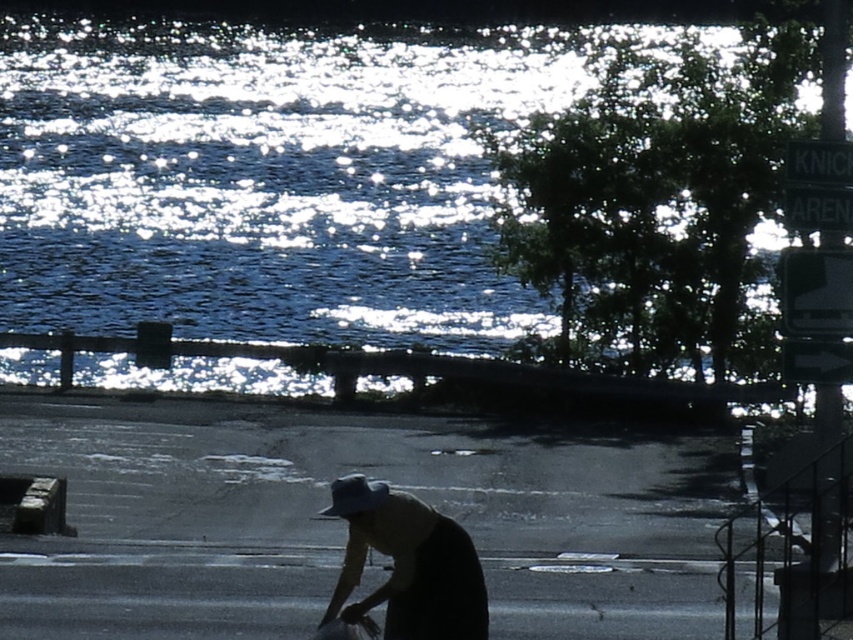
In the scene shown: Is sparkling blue water at upper center above black plastic sign at upper right?

Indeed, sparkling blue water at upper center is positioned over black plastic sign at upper right.

You are a GUI agent. You are given a task and a screenshot of the screen. Output one action in this format:
    pyautogui.click(x=<x>, y=<y>)
    Task: Click on the sparkling blue water at upper center
    The width and height of the screenshot is (853, 640).
    Given the screenshot: What is the action you would take?
    pyautogui.click(x=271, y=168)

Does point (57, 323) lie in front of point (840, 177)?

No, (57, 323) is further to viewer.

Where is `sparkling blue water at upper center`? This screenshot has width=853, height=640. sparkling blue water at upper center is located at coordinates (271, 168).

Is sparkling blue water at upper center thinner than metallic reflective sign at upper right?

No.

Who is more forward, (155, 67) or (804, 282)?

Point (804, 282)

Describe the element at coordinates (271, 168) in the screenshot. The width and height of the screenshot is (853, 640). I see `sparkling blue water at upper center` at that location.

Image resolution: width=853 pixels, height=640 pixels. I want to click on sparkling blue water at upper center, so click(271, 168).

Based on the photo, does silhouette fabric hat at lower center have a larger size compared to metallic reflective sign at upper right?

Yes.

How far apart are silhouette fabric hat at lower center and metallic reflective sign at upper right?

They are 3.23 meters apart.

At what (x,y) coordinates should I click in order to perform the action: click on silhouette fabric hat at lower center. Please return your answer as a coordinate pair (x, y). Image resolution: width=853 pixels, height=640 pixels. Looking at the image, I should click on (407, 564).